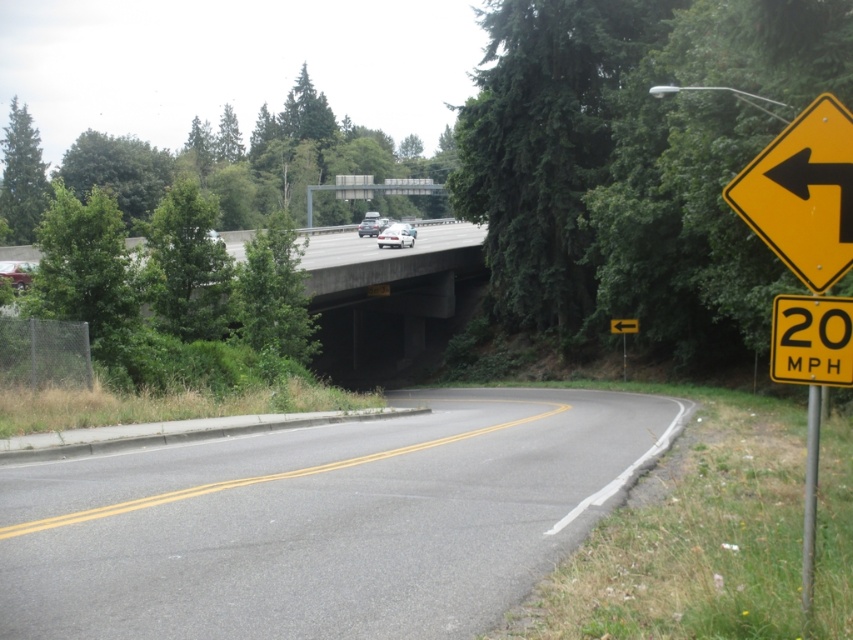
You are driving on the road and see the yellow plastic sign at right and the metallic pole at right. Which one is closer to the center of the road?

The yellow plastic sign at right is closer to the center of the road than the metallic pole at right because it is positioned to the left of the metallic pole at right, which places it nearer to the road center.